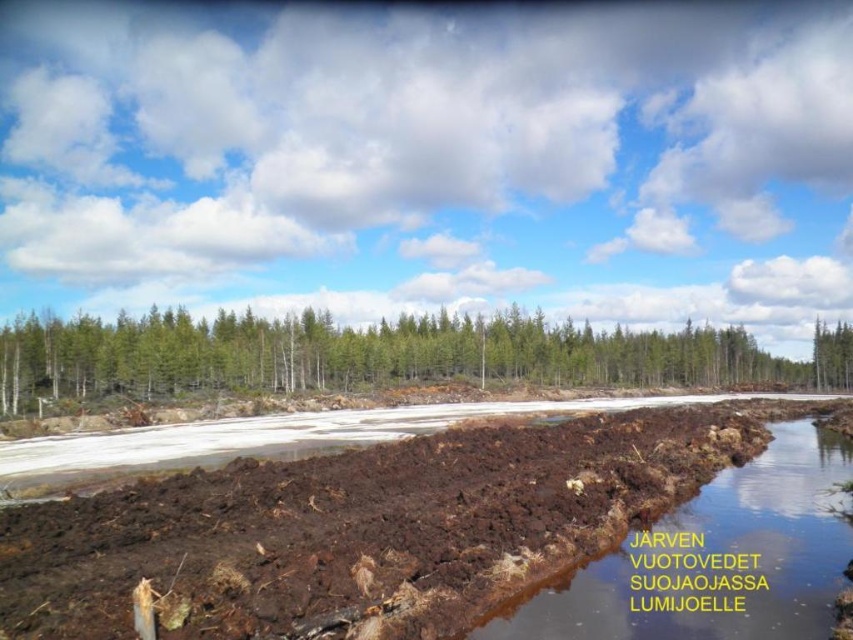
You are standing at the edge of the water in this cold season landscape. You see two points marked in the scene. Which point is closer to you, point (x=184, y=508) or point (x=701, y=589)?

Point (x=184, y=508) is closer to you because it is further to the viewer than point (x=701, y=589).

You are a hiker who wants to cross the area where the brown soil at center and brown muddy water at center are located. Which part should you step on to avoid sinking?

You should step on the brown soil at center because it is above the brown muddy water at center and less likely to sink.